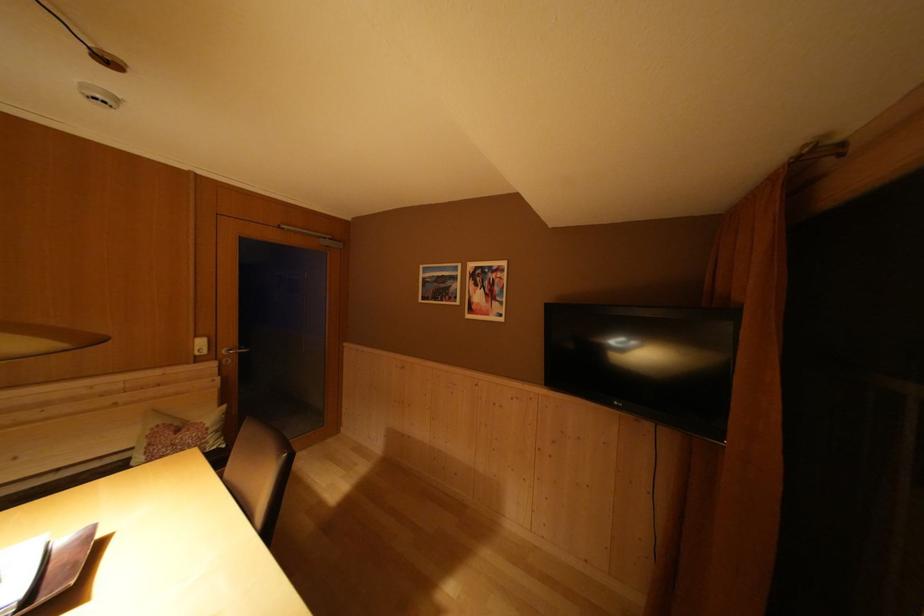
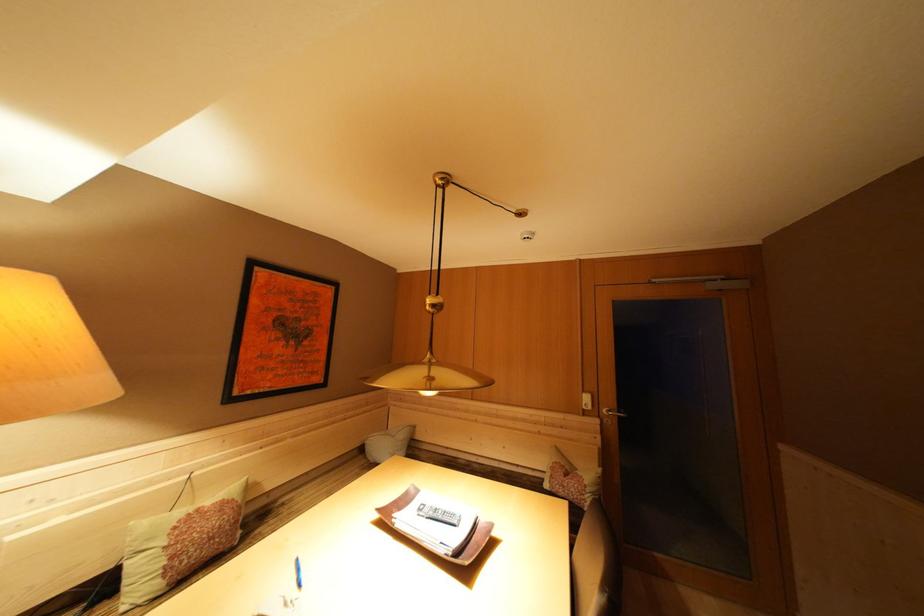
Where in the second image is the point corresponding to the point at 203,342 from the first image?

(590, 397)